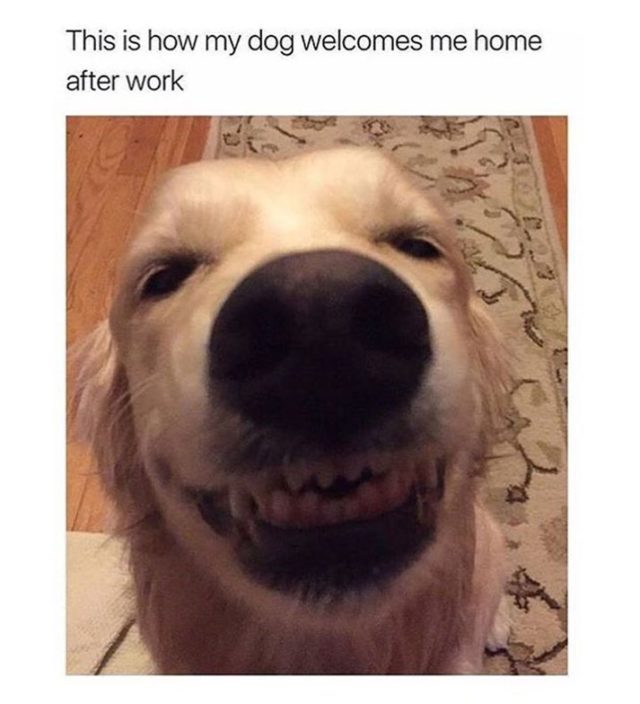
This screenshot has width=640, height=704. In order to click on runner rug in this screenshot , I will do `click(491, 172)`, `click(527, 517)`.